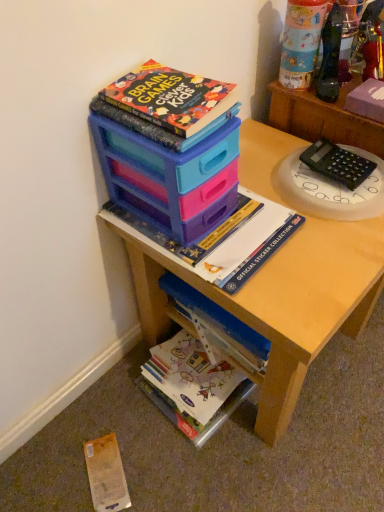
Identify the location of matte plastic storage box at upper center. The height and width of the screenshot is (512, 384). (170, 176).

Measure the distance between point (x=83, y=446) and camera.

3.41 feet.

Measure the distance between yellow paper at lower left and camera.

94.05 centimeters.

Locate an element on the screen. Image resolution: width=384 pixels, height=512 pixels. black plastic calculator at upper right is located at coordinates (x=337, y=163).

Is yellow paper at lower left next to white glossy book at lower center, which is the 1th book from bottom to top?

No.

Which object is more forward, yellow paper at lower left or white glossy book at lower center, the 3th book in the top-to-bottom sequence?

yellow paper at lower left is closer to the camera.

Does yellow paper at lower left turn towards white glossy book at lower center, the 3th book in the top-to-bottom sequence?

No, yellow paper at lower left is not aimed at white glossy book at lower center, the 3th book in the top-to-bottom sequence.

Looking at their sizes, would you say yellow paper at lower left is wider or thinner than white glossy book at lower center, which is the 1th book from bottom to top?

In the image, yellow paper at lower left appears to be more narrow than white glossy book at lower center, which is the 1th book from bottom to top.

Looking at this image, is matte plastic cup at upper right oriented away from wooden desk at center?

No, matte plastic cup at upper right is not facing the opposite direction of wooden desk at center.

Would you say matte plastic cup at upper right is inside or outside wooden desk at center?

matte plastic cup at upper right is outside wooden desk at center.

From a real-world perspective, is matte plastic cup at upper right physically located above or below wooden desk at center?

matte plastic cup at upper right is above wooden desk at center.

From the image's perspective, which is above, matte plastic cup at upper right or wooden desk at center?

matte plastic cup at upper right appears higher in the image.

Consider the image. From the image's perspective, between hardcover book at upper center, which is counted as the 1th book, starting from the top, and black plastic calculator at upper right, who is located below?

From the image's view, black plastic calculator at upper right is below.

From a real-world perspective, between hardcover book at upper center, the 3th book when ordered from bottom to top, and black plastic calculator at upper right, who is vertically higher?

In real-world perspective, hardcover book at upper center, the 3th book when ordered from bottom to top, is above.

Could you tell me if hardcover book at upper center, which is counted as the 1th book, starting from the top, is facing black plastic calculator at upper right?

No, hardcover book at upper center, which is counted as the 1th book, starting from the top, is not turned towards black plastic calculator at upper right.

Are hardcover book at upper center, the 3th book when ordered from bottom to top, and black plastic calculator at upper right far apart?

hardcover book at upper center, the 3th book when ordered from bottom to top, is actually quite close to black plastic calculator at upper right.

Is point (177, 108) more distant than point (298, 289)?

No, (177, 108) is in front of (298, 289).

Does hardcover book at upper center, the 3th book when ordered from bottom to top, have a lesser width compared to wooden desk at center?

Yes, hardcover book at upper center, the 3th book when ordered from bottom to top, is thinner than wooden desk at center.

From the image's perspective, which one is positioned higher, hardcover book at upper center, the 3th book when ordered from bottom to top, or wooden desk at center?

From the image's view, hardcover book at upper center, the 3th book when ordered from bottom to top, is above.

From a real-world perspective, is hardcover book at upper center, which is counted as the 1th book, starting from the top, physically located above or below wooden desk at center?

From a real-world perspective, hardcover book at upper center, which is counted as the 1th book, starting from the top, is physically above wooden desk at center.

Based on the photo, is matte plastic storage at upper center, the second book from the top, facing away from wooden desk at center?

No, wooden desk at center is not at the back of matte plastic storage at upper center, the second book from the top.

Considering their positions, is matte plastic storage at upper center, the second book from the top, located in front of or behind wooden desk at center?

matte plastic storage at upper center, the second book from the top, is positioned farther from the viewer than wooden desk at center.

Consider the image. Can you confirm if matte plastic storage at upper center, the 2th book in the bottom-to-top sequence, is thinner than wooden desk at center?

Yes.

Is matte plastic storage at upper center, the second book from the top, to the right of wooden desk at center from the viewer's perspective?

No, matte plastic storage at upper center, the second book from the top, is not to the right of wooden desk at center.

Looking at this image, is there a large distance between wooden desk at center and matte plastic storage at upper center, the second book from the top?

They are positioned close to each other.

From the image's perspective, count 1st books upward from the wooden desk at center and point to it. Please provide its 2D coordinates.

[(221, 240)]

Is wooden desk at center shorter than matte plastic storage at upper center, the second book from the top?

In fact, wooden desk at center may be taller than matte plastic storage at upper center, the second book from the top.

Considering the sizes of objects yellow paper at lower left and matte plastic cup at upper right in the image provided, who is smaller, yellow paper at lower left or matte plastic cup at upper right?

yellow paper at lower left is smaller.

Based on the photo, is yellow paper at lower left facing away from matte plastic cup at upper right?

yellow paper at lower left is not turned away from matte plastic cup at upper right.

Does yellow paper at lower left appear on the left side of matte plastic cup at upper right?

Correct, you'll find yellow paper at lower left to the left of matte plastic cup at upper right.

From a real-world perspective, is yellow paper at lower left physically above matte plastic cup at upper right?

No, from a real-world perspective, yellow paper at lower left is not above matte plastic cup at upper right.

In order to click on the 1st book directly above the yellow paper at lower left (from a real-world perspective) in this screenshot , I will do `click(192, 387)`.

I want to click on toy above the wooden desk at center (from the image's perspective), so click(301, 42).

Based on their spatial positions, is matte plastic storage box at upper center or matte plastic cup at upper right further from black plastic calculator at upper right?

matte plastic storage box at upper center lies further to black plastic calculator at upper right than the other object.

When comparing their distances from matte plastic storage at upper center, the second book from the top, does hardcover book at upper center, the 3th book when ordered from bottom to top, or matte plastic cup at upper right seem further?

matte plastic cup at upper right.

Considering their positions, is white glossy book at lower center, the 3th book in the top-to-bottom sequence, positioned further to matte plastic cup at upper right than wooden desk at center?

Based on the image, white glossy book at lower center, the 3th book in the top-to-bottom sequence, appears to be further to matte plastic cup at upper right.

Estimate the real-world distances between objects in this image. Which object is further from white glossy book at lower center, the 3th book in the top-to-bottom sequence, matte plastic cup at upper right or hardcover book at upper center, which is counted as the 1th book, starting from the top?

matte plastic cup at upper right is further to white glossy book at lower center, the 3th book in the top-to-bottom sequence.

Considering their positions, is matte plastic cup at upper right positioned closer to wooden desk at center than matte plastic storage at upper center, the second book from the top?

Among the two, matte plastic storage at upper center, the second book from the top, is located nearer to wooden desk at center.

Based on the photo, looking at the image, which one is located further to white glossy book at lower center, which is the 1th book from bottom to top, black plastic calculator at upper right or yellow paper at lower left?

black plastic calculator at upper right.

Estimate the real-world distances between objects in this image. Which object is further from black plastic calculator at upper right, wooden desk at center or hardcover book at upper center, which is counted as the 1th book, starting from the top?

hardcover book at upper center, which is counted as the 1th book, starting from the top, is positioned further to the anchor black plastic calculator at upper right.

Which object lies further to the anchor point hardcover book at upper center, which is counted as the 1th book, starting from the top, black plastic calculator at upper right or matte plastic storage box at upper center?

black plastic calculator at upper right.

You are a GUI agent. You are given a task and a screenshot of the screen. Output one action in this format:
    pyautogui.click(x=<x>, y=<y>)
    Task: Click on the desk between matte plastic cup at upper right and yellow paper at lower left in the up-down direction
    The height and width of the screenshot is (512, 384).
    Given the screenshot: What is the action you would take?
    pyautogui.click(x=276, y=300)

This screenshot has height=512, width=384. Find the location of `desk that lies between matte plastic storage box at upper center and yellow paper at lower left from top to bottom`. desk that lies between matte plastic storage box at upper center and yellow paper at lower left from top to bottom is located at coordinates (276, 300).

This screenshot has height=512, width=384. Find the location of `book that lies between black plastic calculator at upper right and white glossy book at lower center, which is the 1th book from bottom to top, from top to bottom`. book that lies between black plastic calculator at upper right and white glossy book at lower center, which is the 1th book from bottom to top, from top to bottom is located at coordinates (221, 240).

The height and width of the screenshot is (512, 384). What are the coordinates of `book that lies between matte plastic storage at upper center, the second book from the top, and yellow paper at lower left from top to bottom` in the screenshot? It's located at (192, 387).